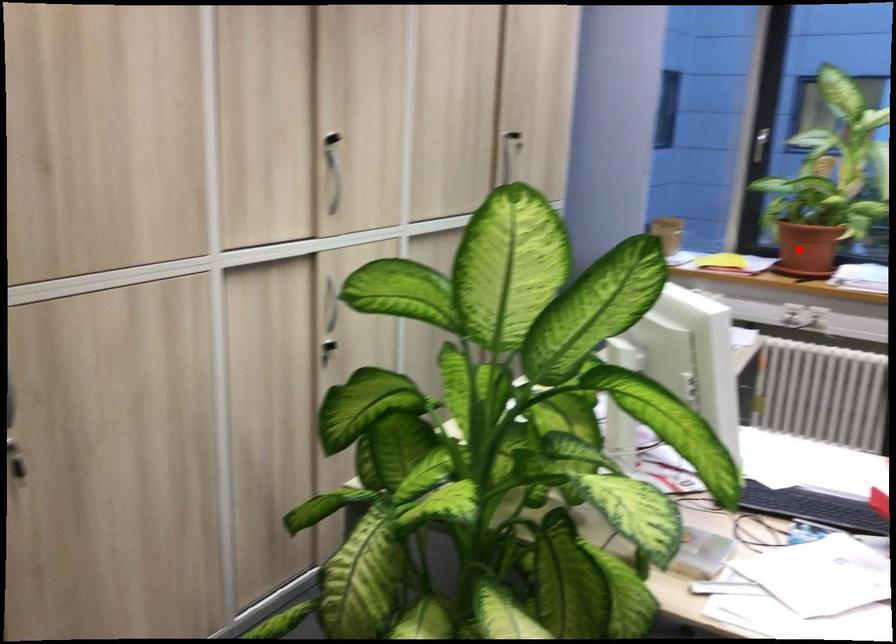
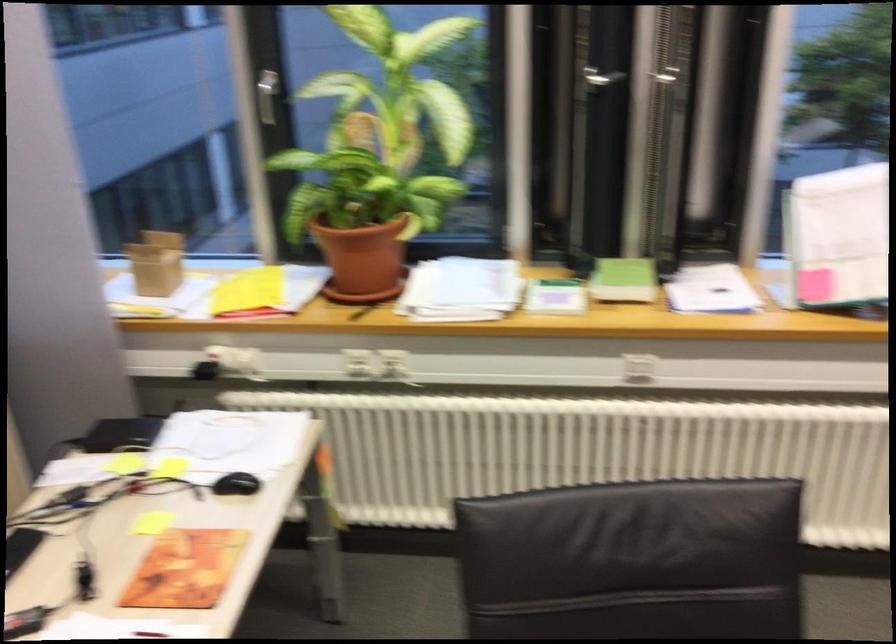
The point at the highlighted location is marked in the first image. Where is the corresponding point in the second image?

(363, 257)